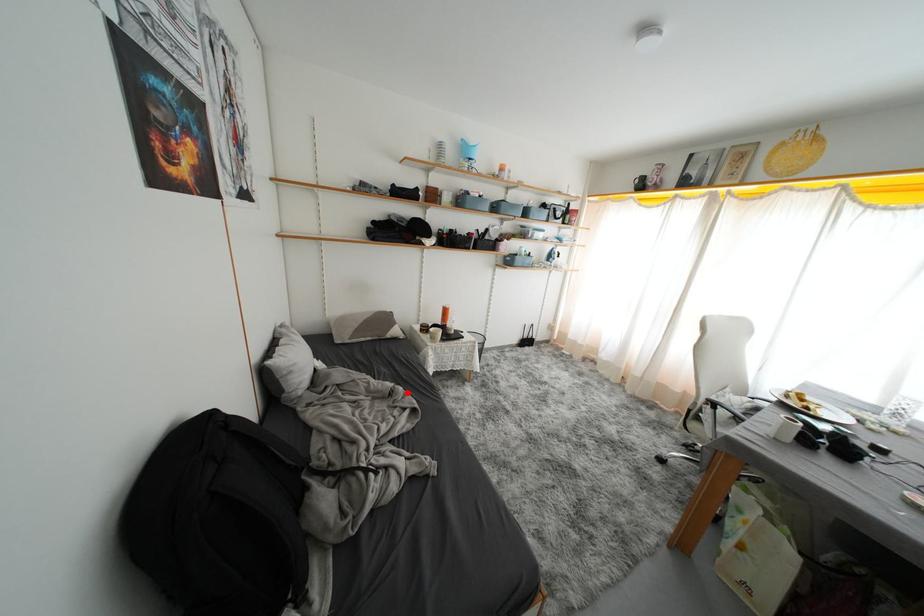
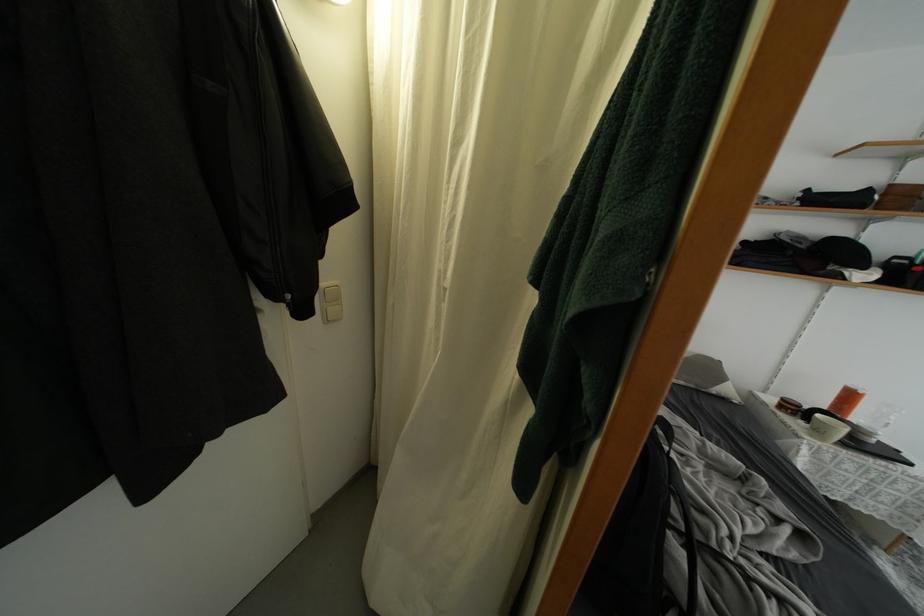
In the second image, find the point that corresponds to the highlighted location in the first image.

(769, 485)